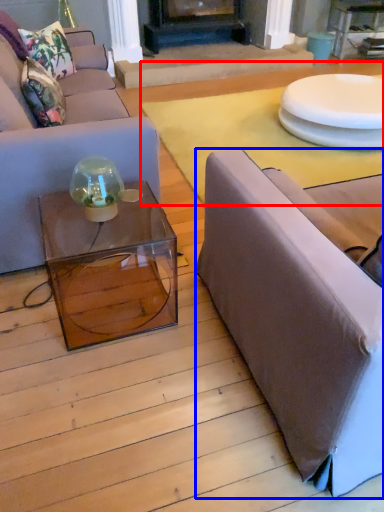
Question: Which object is further to the camera taking this photo, plain (highlighted by a red box) or studio couch (highlighted by a blue box)?

Choices:
 (A) plain
 (B) studio couch

Answer: (A)